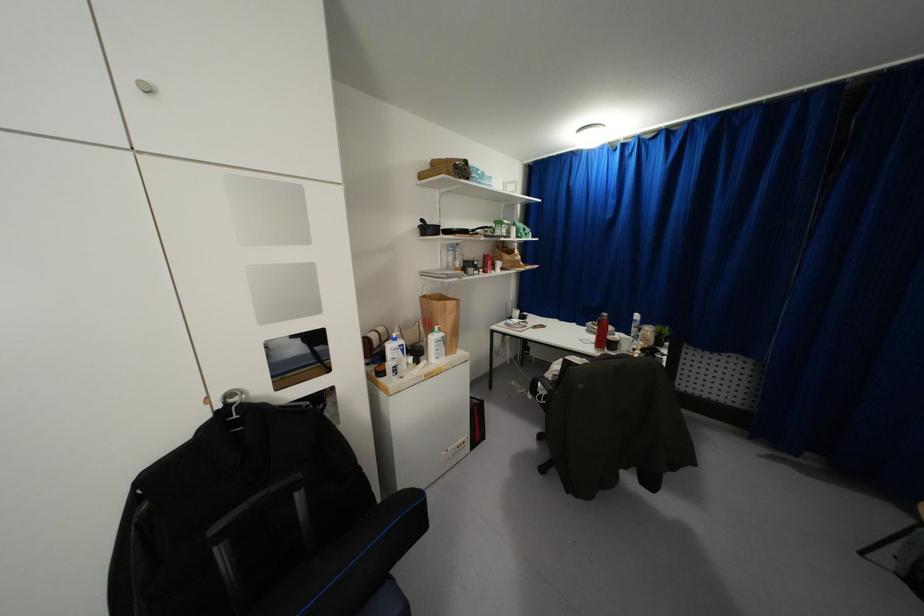
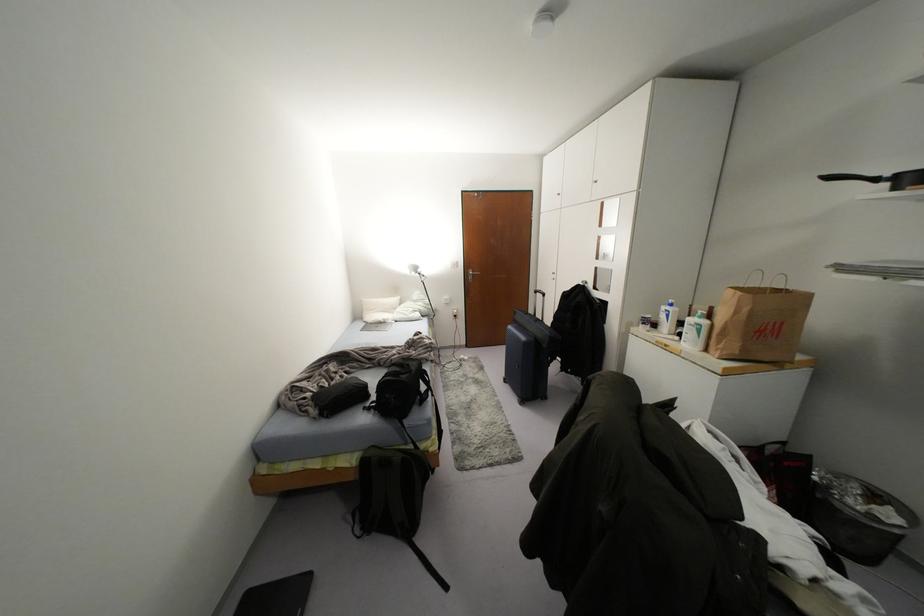
Locate, in the second image, the point that corresponds to (x=402, y=350) in the first image.

(666, 315)